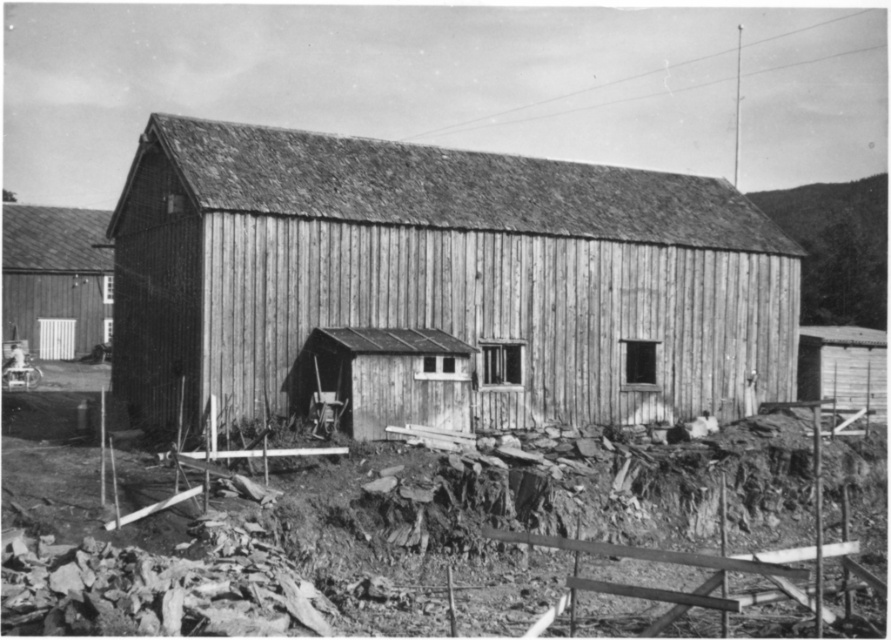
Can you confirm if wooden hut at center is shorter than smooth wooden door at left?

Indeed, wooden hut at center has a lesser height compared to smooth wooden door at left.

Is point (383, 269) more distant than point (79, 346)?

No, (383, 269) is in front of (79, 346).

Locate an element on the screen. wooden hut at center is located at coordinates (440, 275).

Which of these two, rusty metal debris at lower left or smooth wooden door at left, stands shorter?

Standing shorter between the two is rusty metal debris at lower left.

The image size is (891, 640). What do you see at coordinates (654, 572) in the screenshot?
I see `rusty metal debris at lower left` at bounding box center [654, 572].

At what (x,y) coordinates should I click in order to perform the action: click on rusty metal debris at lower left. Please return your answer as a coordinate pair (x, y). This screenshot has height=640, width=891. Looking at the image, I should click on (654, 572).

Where is `wooden hut at center`? Image resolution: width=891 pixels, height=640 pixels. wooden hut at center is located at coordinates (440, 275).

Measure the distance between wooden hut at center and camera.

wooden hut at center is 20.02 meters away from camera.

Identify the location of wooden hut at center. Image resolution: width=891 pixels, height=640 pixels. (440, 275).